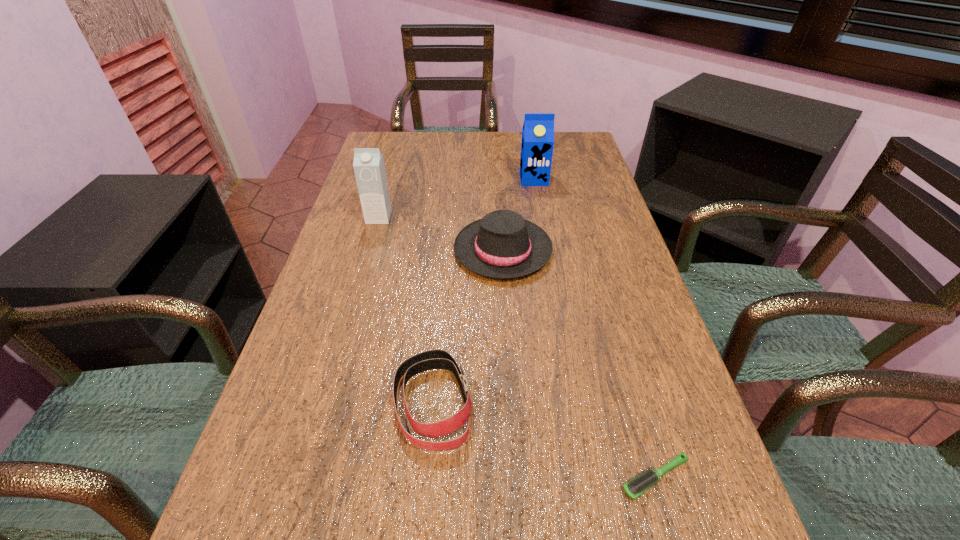
This screenshot has width=960, height=540. Find the location of `empty location between the rightmost object and the dress hat`. empty location between the rightmost object and the dress hat is located at coordinates (579, 364).

Find the location of `free space between the fourth tallest object and the nearest object`. free space between the fourth tallest object and the nearest object is located at coordinates pos(544,440).

At what (x,y) coordinates should I click in order to perform the action: click on free space between the third shortest object and the dog collar. Please return your answer as a coordinate pair (x, y). Looking at the image, I should click on (468, 326).

Find the location of a particular element. The height and width of the screenshot is (540, 960). free space between the rightmost object and the third shortest object is located at coordinates (579, 364).

The image size is (960, 540). Identify the location of vacant space in between the nearest object and the farthest object. coord(594,328).

This screenshot has height=540, width=960. What are the coordinates of `free space between the leftmost object and the second nearest object` in the screenshot? It's located at (406, 310).

You are a GUI agent. You are given a task and a screenshot of the screen. Output one action in this format:
    pyautogui.click(x=<x>, y=<y>)
    Task: Click on the unoccupied position between the right carton and the nearer carton
    This screenshot has width=960, height=540.
    Given the screenshot: What is the action you would take?
    pyautogui.click(x=456, y=198)

In order to click on empty location between the dress hat and the shortest object in this screenshot , I will do `click(579, 364)`.

You are a GUI agent. You are given a task and a screenshot of the screen. Output one action in this format:
    pyautogui.click(x=<x>, y=<y>)
    Task: Click on the vacant area that lies between the dog collar and the third shortest object
    This screenshot has height=540, width=960.
    Given the screenshot: What is the action you would take?
    pyautogui.click(x=468, y=326)

Identify the location of free space between the fourth farthest object and the farther carton. (484, 291).